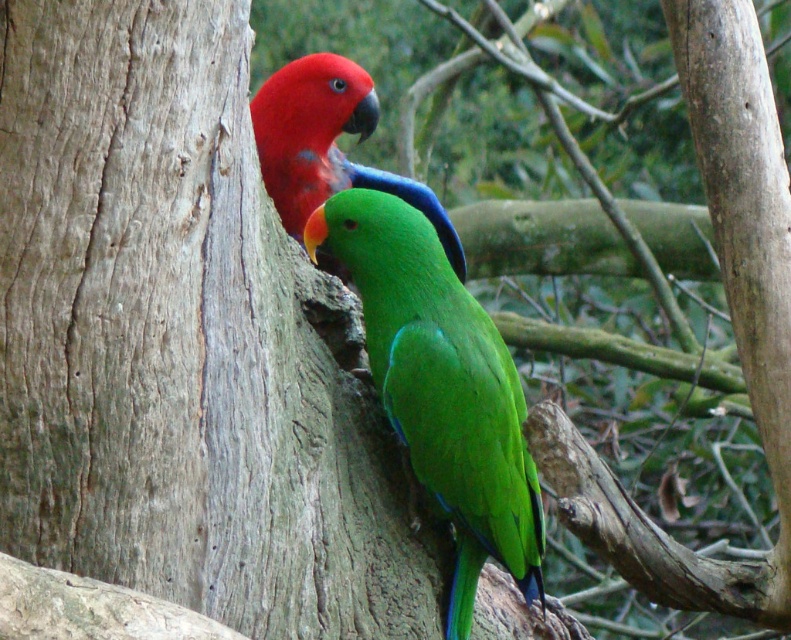
You are a birdwatcher trying to identify the parrots in the image. You notice two parrots, the green glossy parrot at center and the matte red parrot at upper left. Which parrot is larger in size?

The green glossy parrot at center is bigger than the matte red parrot at upper left.

You are a birdwatcher trying to identify the parrots in the image. You notice two parrots perched on a tree trunk. The green glossy parrot at center and the matte red parrot at upper left. Which parrot is taller?

The green glossy parrot at center is much taller than the matte red parrot at upper left.